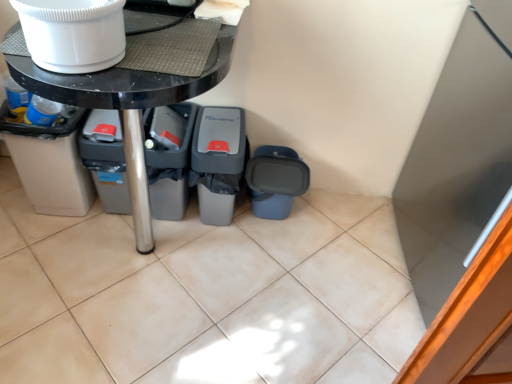
The height and width of the screenshot is (384, 512). What are the coordinates of `empty space that is to the right of black glossy table at center` in the screenshot? It's located at (293, 277).